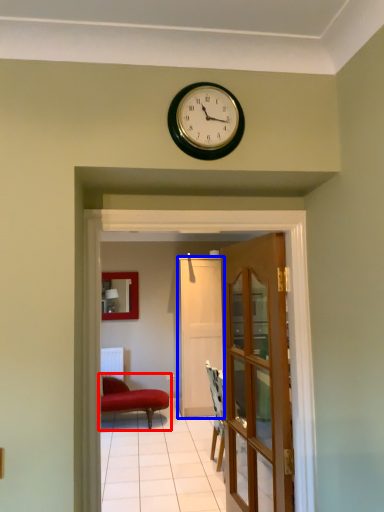
Question: Which object appears closest to the camera in this image, studio couch (highlighted by a red box) or door (highlighted by a blue box)?

Choices:
 (A) studio couch
 (B) door

Answer: (A)